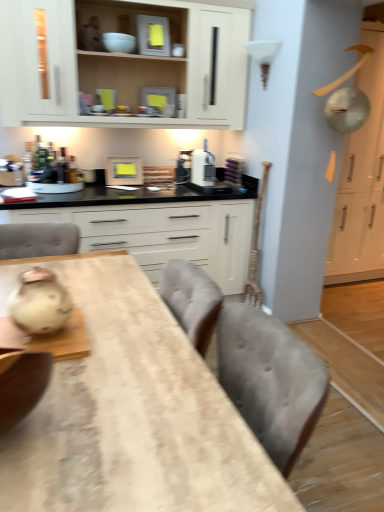
Question: Is wooden table at center turned away from metallic silver toaster at upper center, which is counted as the 2th appliance, starting from the back?

Choices:
 (A) no
 (B) yes

Answer: (A)

Question: Are wooden table at center and metallic silver toaster at upper center, which is counted as the 2th appliance, starting from the back, located far from each other?

Choices:
 (A) no
 (B) yes

Answer: (B)

Question: Does wooden table at center have a lesser width compared to metallic silver toaster at upper center, which ranks as the second appliance in top-to-bottom order?

Choices:
 (A) yes
 (B) no

Answer: (B)

Question: Considering the relative positions of wooden table at center and metallic silver toaster at upper center, the second appliance in the bottom-to-top sequence, in the image provided, is wooden table at center to the right of metallic silver toaster at upper center, the second appliance in the bottom-to-top sequence, from the viewer's perspective?

Choices:
 (A) yes
 (B) no

Answer: (B)

Question: Is metallic silver toaster at upper center, which ranks as the second appliance in top-to-bottom order, located within wooden table at center?

Choices:
 (A) no
 (B) yes

Answer: (A)

Question: From the image's perspective, is metallic silver toaster at upper center, which is counted as the 2th appliance, starting from the back, above or below wooden frame at upper center, which is the 3th appliance from front to back?

Choices:
 (A) above
 (B) below

Answer: (A)

Question: Considering the relative positions of metallic silver toaster at upper center, which ranks as the second appliance in top-to-bottom order, and wooden frame at upper center, which is the 3th appliance from front to back, in the image provided, is metallic silver toaster at upper center, which ranks as the second appliance in top-to-bottom order, to the left or to the right of wooden frame at upper center, which is the 3th appliance from front to back,?

Choices:
 (A) left
 (B) right

Answer: (B)

Question: Is metallic silver toaster at upper center, which ranks as the second appliance in top-to-bottom order, in front of or behind wooden frame at upper center, which is the 3th appliance from front to back, in the image?

Choices:
 (A) behind
 (B) front

Answer: (B)

Question: Based on their sizes in the image, would you say metallic silver toaster at upper center, which ranks as the second appliance in top-to-bottom order, is bigger or smaller than wooden frame at upper center, which is the third appliance in top-to-bottom order?

Choices:
 (A) small
 (B) big

Answer: (A)

Question: Do you think white matte cabinet at center, the first cabinetry from the left, is within matte gray toaster at upper center, which is counted as the 3th appliance, starting from the back, or outside of it?

Choices:
 (A) outside
 (B) inside

Answer: (A)

Question: Visually, is white matte cabinet at center, the first cabinetry from the left, positioned to the left or to the right of matte gray toaster at upper center, positioned as the 1th appliance in front-to-back order?

Choices:
 (A) right
 (B) left

Answer: (B)

Question: From a real-world perspective, is white matte cabinet at center, acting as the 3th cabinetry starting from the right, above or below matte gray toaster at upper center, positioned as the 1th appliance in front-to-back order?

Choices:
 (A) above
 (B) below

Answer: (B)

Question: From the image's perspective, is white matte cabinet at center, the first cabinetry from the left, above or below matte gray toaster at upper center, which is counted as the 3th appliance, starting from the back?

Choices:
 (A) above
 (B) below

Answer: (B)

Question: Visually, is white glossy cabinet at upper right, the third cabinetry in the left-to-right sequence, positioned to the left or to the right of white matte cabinet at center, acting as the 3th cabinetry starting from the right?

Choices:
 (A) left
 (B) right

Answer: (B)

Question: Is white glossy cabinet at upper right, the third cabinetry in the left-to-right sequence, in front of or behind white matte cabinet at center, acting as the 3th cabinetry starting from the right, in the image?

Choices:
 (A) front
 (B) behind

Answer: (B)